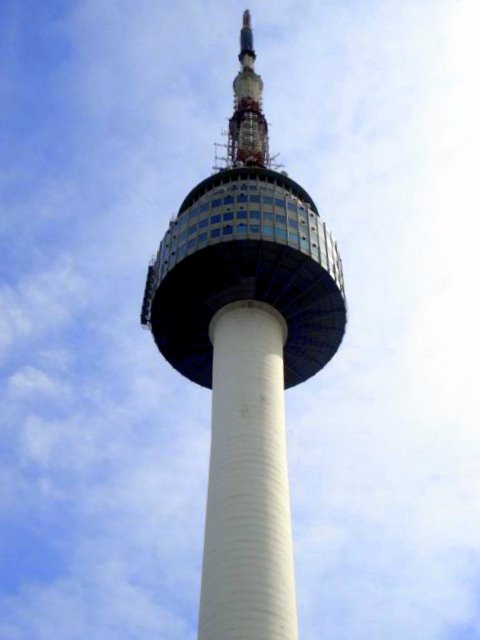
I want to click on empty space to the left of the cylindrical pillar, so click(x=200, y=548).